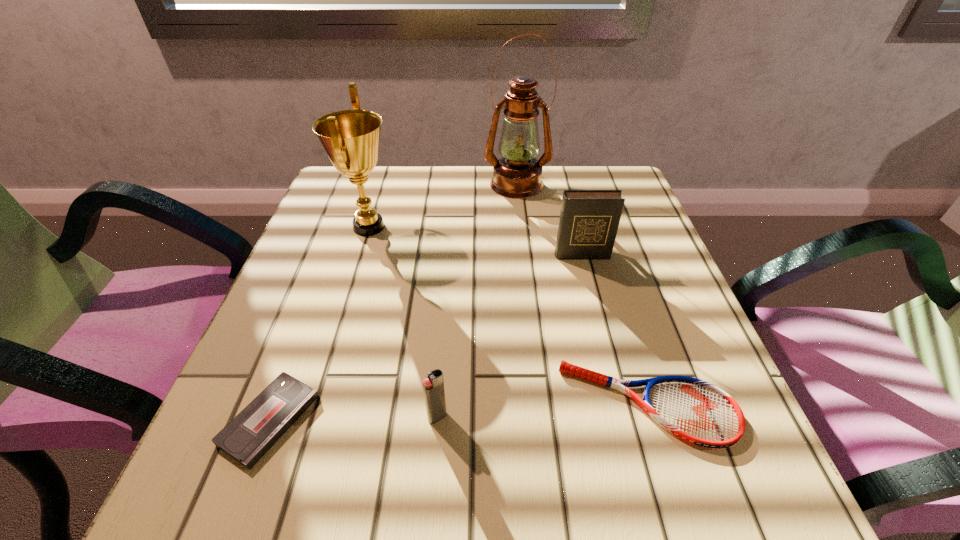
At what (x,y) coordinates should I click in order to perform the action: click on free location located on the front cover of the fourth shortest object. Please return your answer as a coordinate pair (x, y). This screenshot has width=960, height=540. Looking at the image, I should click on (589, 287).

At what (x,y) coordinates should I click in order to perform the action: click on free space located 0.170m on the left of the fourth object from right to left. Please return your answer as a coordinate pair (x, y). This screenshot has height=540, width=960. Looking at the image, I should click on (312, 417).

This screenshot has height=540, width=960. Find the location of `free space located on the left of the tennis racket`. free space located on the left of the tennis racket is located at coordinates (303, 404).

Locate an element on the screen. The height and width of the screenshot is (540, 960). vacant space located on the back of the videotape is located at coordinates (336, 246).

Where is `oil lamp located in the far edge section of the desktop`? The height and width of the screenshot is (540, 960). oil lamp located in the far edge section of the desktop is located at coordinates (517, 174).

I want to click on award positioned at the far edge, so click(x=351, y=138).

This screenshot has width=960, height=540. Find the location of `tennis racket that is at the near edge`. tennis racket that is at the near edge is located at coordinates (698, 412).

The width and height of the screenshot is (960, 540). What are the coordinates of `videotape that is at the near edge` in the screenshot? It's located at (246, 438).

Find the location of a particular element. The width and height of the screenshot is (960, 540). award present at the left edge is located at coordinates (351, 138).

The height and width of the screenshot is (540, 960). I want to click on videotape positioned at the left edge, so click(246, 438).